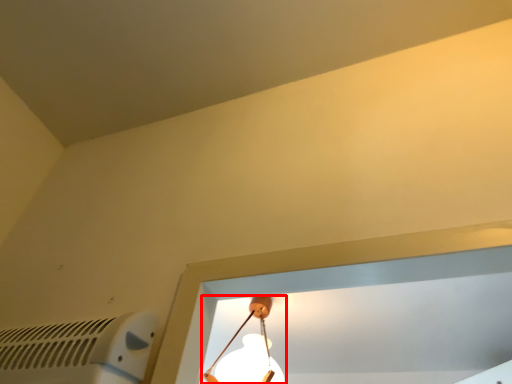
Question: From the image, what is the correct spatial relationship of lamp (annotated by the red box) in relation to air conditioning?

Choices:
 (A) right
 (B) left

Answer: (A)